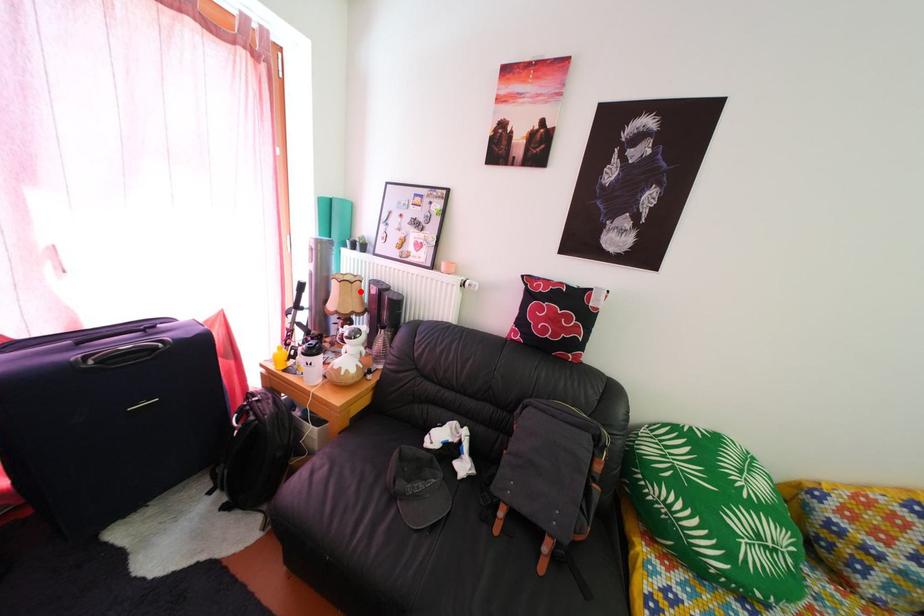
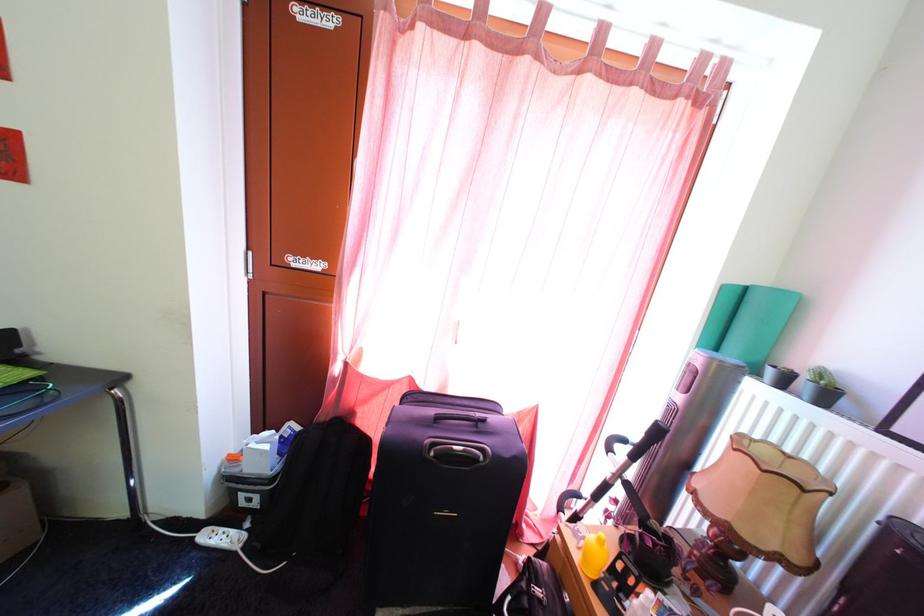
Where in the second image is the point corresponding to the highlighted location from the first image?

(812, 499)